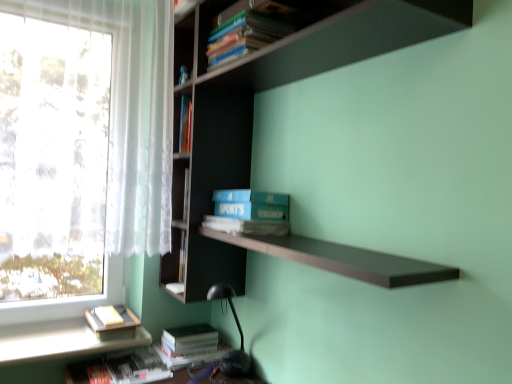
Question: From a real-world perspective, is hardcover book at lower left, which appears as the 1th book when ordered from the bottom, physically above hardcover book at lower left, the fourth book from the top?

Choices:
 (A) no
 (B) yes

Answer: (A)

Question: From the image's perspective, is hardcover book at lower left, which appears as the 1th book when ordered from the bottom, beneath hardcover book at lower left, the second book when ordered from bottom to top?

Choices:
 (A) no
 (B) yes

Answer: (B)

Question: Considering the relative sizes of hardcover book at lower left, which appears as the 1th book when ordered from the bottom, and hardcover book at lower left, the second book when ordered from bottom to top, in the image provided, is hardcover book at lower left, which appears as the 1th book when ordered from the bottom, bigger than hardcover book at lower left, the second book when ordered from bottom to top,?

Choices:
 (A) yes
 (B) no

Answer: (B)

Question: Is hardcover book at lower left, which is the 5th book from top to bottom, not within hardcover book at lower left, the second book when ordered from bottom to top?

Choices:
 (A) no
 (B) yes

Answer: (B)

Question: Is hardcover book at lower left, which is the 5th book from top to bottom, with hardcover book at lower left, the fourth book from the top?

Choices:
 (A) no
 (B) yes

Answer: (A)

Question: Does hardcover book at lower left, which is the 5th book from top to bottom, have a lesser width compared to hardcover book at lower left, the fourth book from the top?

Choices:
 (A) yes
 (B) no

Answer: (A)

Question: Is hardcover book at lower left, the third book in the top-to-bottom sequence, smaller than hardcover book at lower left, the second book when ordered from bottom to top?

Choices:
 (A) no
 (B) yes

Answer: (B)

Question: Is the position of hardcover book at lower left, the third book in the top-to-bottom sequence, more distant than that of hardcover book at lower left, the second book when ordered from bottom to top?

Choices:
 (A) no
 (B) yes

Answer: (A)

Question: Can you confirm if hardcover book at lower left, the third book in the top-to-bottom sequence, is bigger than hardcover book at lower left, the second book when ordered from bottom to top?

Choices:
 (A) yes
 (B) no

Answer: (B)

Question: Can we say hardcover book at lower left, the third book in the top-to-bottom sequence, lies outside hardcover book at lower left, the second book when ordered from bottom to top?

Choices:
 (A) no
 (B) yes

Answer: (B)

Question: From the image's perspective, would you say hardcover book at lower left, the 3th book from the bottom, is shown under hardcover book at lower left, the fourth book from the top?

Choices:
 (A) no
 (B) yes

Answer: (A)

Question: From a real-world perspective, is hardcover book at lower left, the third book in the top-to-bottom sequence, over hardcover book at lower left, the second book when ordered from bottom to top?

Choices:
 (A) no
 (B) yes

Answer: (B)

Question: Is hardcover book at lower left, which is the 5th book from top to bottom, at the back of blue matte sports book at center?

Choices:
 (A) yes
 (B) no

Answer: (B)